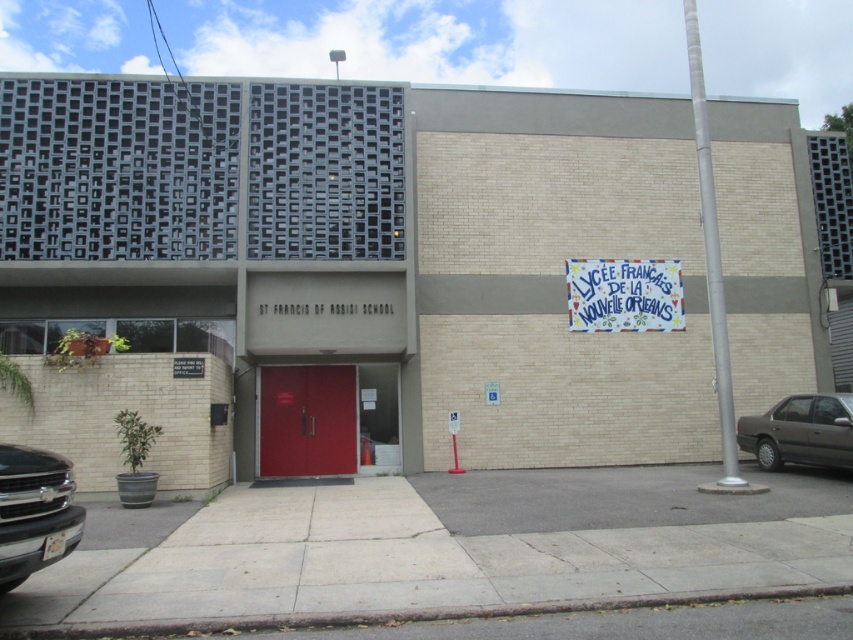
You are a visitor arriving at St Francis of Assisi School. You see a black glossy truck at lower left and a dark gray metallic sedan at lower right. Which vehicle is closer to the entrance?

The black glossy truck at lower left is closer to the entrance because it is in front of the dark gray metallic sedan at lower right.

What are the coordinates of the matte red door at center?

The coordinates of the matte red door at center are point (x=306, y=420).

What is the relationship between the size of the matte red door at center and the dark gray metallic sedan at lower right in terms of their dimensions?

The matte red door at center has a smaller size compared to the dark gray metallic sedan at lower right.